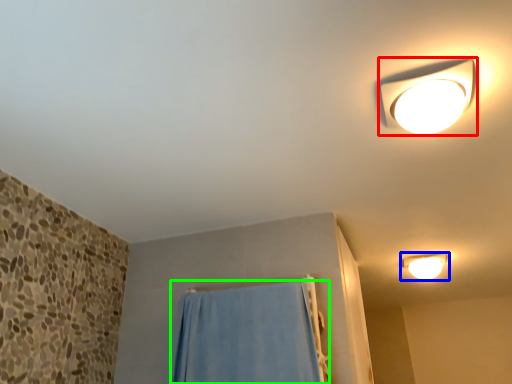
Question: Which object is the closest to the lamp (highlighted by a red box)? Choose among these: lamp (highlighted by a blue box) or curtain (highlighted by a green box).

Choices:
 (A) lamp
 (B) curtain

Answer: (B)